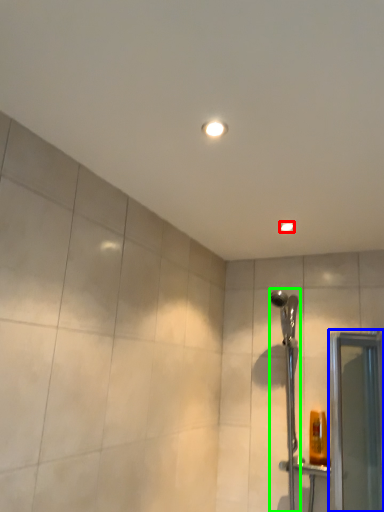
Question: Which object is the closest to the light fixture (highlighted by a red box)? Choose among these: screen door (highlighted by a blue box) or shower (highlighted by a green box).

Choices:
 (A) screen door
 (B) shower

Answer: (B)